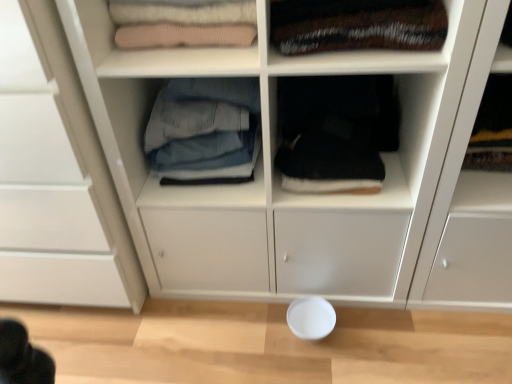
This screenshot has width=512, height=384. What do you see at coordinates (205, 129) in the screenshot?
I see `denim jeans at center, the second clothing positioned from the right` at bounding box center [205, 129].

From the picture: What is the approximate height of velvet-like brown blanket at upper right, the 2th clothing viewed from the left?

The height of velvet-like brown blanket at upper right, the 2th clothing viewed from the left, is 4.51 inches.

Where is `knit fabric sweater at upper left, the second shelf from the bottom`? The image size is (512, 384). knit fabric sweater at upper left, the second shelf from the bottom is located at coordinates [x=182, y=39].

Where is `denim jeans at center, the second clothing positioned from the right`? This screenshot has width=512, height=384. denim jeans at center, the second clothing positioned from the right is located at coordinates (205, 129).

Consider the image. Measure the distance between black fabric at center, which is the 1th shelf from right to left, and denim jeans at center, the second clothing positioned from the right.

black fabric at center, which is the 1th shelf from right to left, is 18.52 centimeters away from denim jeans at center, the second clothing positioned from the right.

Is point (422, 159) farther from viewer compared to point (168, 86)?

No, it is in front of (168, 86).

Considering the relative positions of black fabric at center, which is the 1th shelf from right to left, and denim jeans at center, the second clothing positioned from the right, in the image provided, is black fabric at center, which is the 1th shelf from right to left, in front of denim jeans at center, the second clothing positioned from the right,?

No, the depth of black fabric at center, which is the 1th shelf from right to left, is greater than that of denim jeans at center, the second clothing positioned from the right.

Does black fabric at center, which is the 1th shelf from right to left, have a greater height compared to denim jeans at center, the second clothing positioned from the right?

No, black fabric at center, which is the 1th shelf from right to left, is not taller than denim jeans at center, the second clothing positioned from the right.

From a real-world perspective, relative to black fabric at center, arranged as the 2th shelf when viewed from the top, is knit fabric sweater at upper left, the second shelf from the bottom, vertically above or below?

knit fabric sweater at upper left, the second shelf from the bottom, is situated higher than black fabric at center, arranged as the 2th shelf when viewed from the top, in the real world.

Is knit fabric sweater at upper left, the second shelf from the bottom, oriented away from black fabric at center, which is counted as the second shelf, starting from the left?

knit fabric sweater at upper left, the second shelf from the bottom, does not have its back to black fabric at center, which is counted as the second shelf, starting from the left.

You are a GUI agent. You are given a task and a screenshot of the screen. Output one action in this format:
    pyautogui.click(x=<x>, y=<y>)
    Task: Click on the shelf that appears in front of the black fabric at center, which is counted as the second shelf, starting from the left
    
    Given the screenshot: What is the action you would take?
    pyautogui.click(x=182, y=39)

Which is less distant, (207, 15) or (362, 203)?

Point (207, 15) appears to be closer to the viewer than point (362, 203).

Are velvet-like brown blanket at upper right, the 2th clothing viewed from the left, and denim jeans at center, acting as the 1th clothing starting from the left, far apart?

No.

From a real-world perspective, which object stands above the other?

In real-world perspective, velvet-like brown blanket at upper right, the 2th clothing viewed from the left, is above.

Does velvet-like brown blanket at upper right, the first clothing in the right-to-left sequence, appear on the right side of denim jeans at center, acting as the 1th clothing starting from the left?

Yes.

From the image's perspective, which is below, black fabric at center, arranged as the 2th shelf when viewed from the top, or white matte cabinet at upper left?

white matte cabinet at upper left appears lower in the image.

Is white matte cabinet at upper left completely or partially inside black fabric at center, the 1th shelf from the bottom?

That's incorrect, white matte cabinet at upper left is not inside black fabric at center, the 1th shelf from the bottom.

Is point (281, 198) closer or farther from the camera than point (122, 225)?

Point (281, 198) appears to be closer to the viewer than point (122, 225).

What's the angular difference between black fabric at center, which is the 1th shelf from right to left, and white matte cabinet at upper left's facing directions?

1.62 degrees.

Who is more distant, white matte cabinet at upper left or denim jeans at center, the second clothing positioned from the right?

denim jeans at center, the second clothing positioned from the right, is further from the camera.

The width and height of the screenshot is (512, 384). I want to click on the 1st clothing above the white matte cabinet at upper left (from the image's perspective), so click(205, 129).

Measure the distance between white matte cabinet at upper left and denim jeans at center, acting as the 1th clothing starting from the left.

white matte cabinet at upper left is 28.50 centimeters away from denim jeans at center, acting as the 1th clothing starting from the left.

Is white matte cabinet at upper left to the left of denim jeans at center, the second clothing positioned from the right, from the viewer's perspective?

Indeed, white matte cabinet at upper left is positioned on the left side of denim jeans at center, the second clothing positioned from the right.

Can we say velvet-like brown blanket at upper right, the first clothing in the right-to-left sequence, lies outside black fabric at center, which is the 1th shelf from right to left?

velvet-like brown blanket at upper right, the first clothing in the right-to-left sequence, is positioned outside black fabric at center, which is the 1th shelf from right to left.

Considering the positions of point (365, 38) and point (354, 204), is point (365, 38) closer or farther from the camera than point (354, 204)?

Point (365, 38) is closer to the camera than point (354, 204).

Does velvet-like brown blanket at upper right, the 2th clothing viewed from the left, have a lesser height compared to black fabric at center, which is the 1th shelf from right to left?

Yes.

Is denim jeans at center, acting as the 1th clothing starting from the left, far from black fabric at center, which is counted as the second shelf, starting from the left?

No, denim jeans at center, acting as the 1th clothing starting from the left, is not far away from black fabric at center, which is counted as the second shelf, starting from the left.

Does denim jeans at center, the second clothing positioned from the right, have a greater width compared to black fabric at center, which is the 1th shelf from right to left?

In fact, denim jeans at center, the second clothing positioned from the right, might be narrower than black fabric at center, which is the 1th shelf from right to left.

Consider the image. From a real-world perspective, between denim jeans at center, acting as the 1th clothing starting from the left, and black fabric at center, the 1th shelf from the bottom, who is vertically lower?

black fabric at center, the 1th shelf from the bottom.

From a real-world perspective, starting from the black fabric at center, arranged as the 2th shelf when viewed from the top, which clothing is the 1st one vertically above it? Please provide its 2D coordinates.

[(205, 129)]

Find the location of a particular element. shelf in front of the black fabric at center, arranged as the 2th shelf when viewed from the top is located at coordinates (182, 39).

Estimate the real-world distances between objects in this image. Which object is closer to black fabric at center, the 1th shelf from the bottom, velvet-like brown blanket at upper right, the first clothing in the right-to-left sequence, or white matte cabinet at upper left?

velvet-like brown blanket at upper right, the first clothing in the right-to-left sequence.

Estimate the real-world distances between objects in this image. Which object is closer to white matte cabinet at upper left, black fabric at center, arranged as the 2th shelf when viewed from the top, or velvet-like brown blanket at upper right, the first clothing in the right-to-left sequence?

Based on the image, black fabric at center, arranged as the 2th shelf when viewed from the top, appears to be nearer to white matte cabinet at upper left.

Estimate the real-world distances between objects in this image. Which object is closer to knit fabric sweater at upper left, the second shelf from the bottom, velvet-like brown blanket at upper right, the 2th clothing viewed from the left, or white matte cabinet at upper left?

The object closer to knit fabric sweater at upper left, the second shelf from the bottom, is velvet-like brown blanket at upper right, the 2th clothing viewed from the left.

Based on their spatial positions, is white matte bowl at lower center or white matte cabinet at upper left closer to knit fabric sweater at upper left, placed as the 1th shelf when sorted from top to bottom?

white matte cabinet at upper left lies closer to knit fabric sweater at upper left, placed as the 1th shelf when sorted from top to bottom, than the other object.

Looking at this image, which object lies nearer to the anchor point white matte cabinet at upper left, velvet-like brown blanket at upper right, the first clothing in the right-to-left sequence, or white matte bowl at lower center?

velvet-like brown blanket at upper right, the first clothing in the right-to-left sequence, lies closer to white matte cabinet at upper left than the other object.

From the picture: Estimate the real-world distances between objects in this image. Which object is further from denim jeans at center, acting as the 1th clothing starting from the left, knit fabric sweater at upper left, which appears as the 1th shelf when viewed from the left, or white matte bowl at lower center?

white matte bowl at lower center is further to denim jeans at center, acting as the 1th clothing starting from the left.

Estimate the real-world distances between objects in this image. Which object is further from black fabric at center, which is counted as the second shelf, starting from the left, white matte cabinet at upper left or white matte bowl at lower center?

Based on the image, white matte cabinet at upper left appears to be further to black fabric at center, which is counted as the second shelf, starting from the left.

From the image, which object appears to be farther from velvet-like brown blanket at upper right, the 2th clothing viewed from the left, knit fabric sweater at upper left, acting as the 2th shelf starting from the right, or white matte bowl at lower center?

white matte bowl at lower center.

Image resolution: width=512 pixels, height=384 pixels. I want to click on bowl located between white matte cabinet at upper left and black fabric at center, which is counted as the second shelf, starting from the left, in the left-right direction, so click(311, 318).

You are a GUI agent. You are given a task and a screenshot of the screen. Output one action in this format:
    pyautogui.click(x=<x>, y=<y>)
    Task: Click on the shelf between white matte cabinet at upper left and white matte bowl at lower center
    
    Given the screenshot: What is the action you would take?
    pyautogui.click(x=182, y=39)

Where is `clothing between knit fabric sweater at upper left, acting as the 2th shelf starting from the right, and velvet-like brown blanket at upper right, the first clothing in the right-to-left sequence`? clothing between knit fabric sweater at upper left, acting as the 2th shelf starting from the right, and velvet-like brown blanket at upper right, the first clothing in the right-to-left sequence is located at coordinates (205, 129).

This screenshot has width=512, height=384. What are the coordinates of `shelf between white matte cabinet at upper left and black fabric at center, which is the 1th shelf from right to left, in the horizontal direction` in the screenshot? It's located at (182, 39).